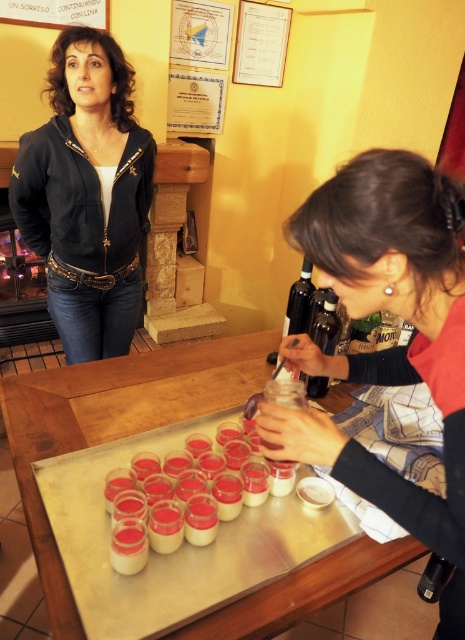
Can you confirm if black leather jacket at upper left is positioned to the right of translucent glass bottle at center?

No, black leather jacket at upper left is not to the right of translucent glass bottle at center.

Between point (127, 257) and point (309, 387), which one is positioned behind?

The point (127, 257) is behind.

Find the location of a particular element. black leather jacket at upper left is located at coordinates (87, 195).

Which is more to the right, white creamy pudding at center or dark glass bottle at center?

dark glass bottle at center is more to the right.

Is white creamy pudding at center above dark glass bottle at center?

No.

Locate an element on the screen. white creamy pudding at center is located at coordinates (180, 499).

Where is `white creamy pudding at center`? The image size is (465, 640). white creamy pudding at center is located at coordinates (180, 499).

Measure the distance between point (314,392) and camera.

Point (314,392) is 1.45 meters away from camera.

Is translucent glass bottle at center smaller than dark glass bottle at center?

Correct, translucent glass bottle at center occupies less space than dark glass bottle at center.

Where is `translucent glass bottle at center`? This screenshot has height=640, width=465. translucent glass bottle at center is located at coordinates (325, 324).